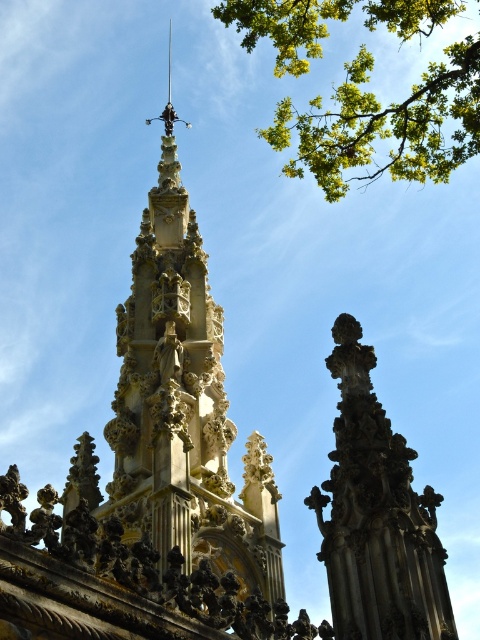
Looking at the Gothic structure, where is the green leafy branch at upper right in relation to the carved stone spire at center?

The green leafy branch at upper right is to the right of the carved stone spire at center.

You are an architect analyzing the Gothic structure. The golden stone spire at center is located at point (183, 406). Can you confirm if this point falls within the central third of the image horizontally?

The golden stone spire at center is located at point (183, 406). Since the central third horizontally would be between 0.333 and 0.666, the x coordinate 0.637 falls within this range, so yes, it is within the central third horizontally.

You are an architect examining the Gothic structure. You notice the green leafy branch at upper right and the carved stone spire at center. Which object has a greater width?

The green leafy branch at upper right has a greater width than the carved stone spire at center according to the description.